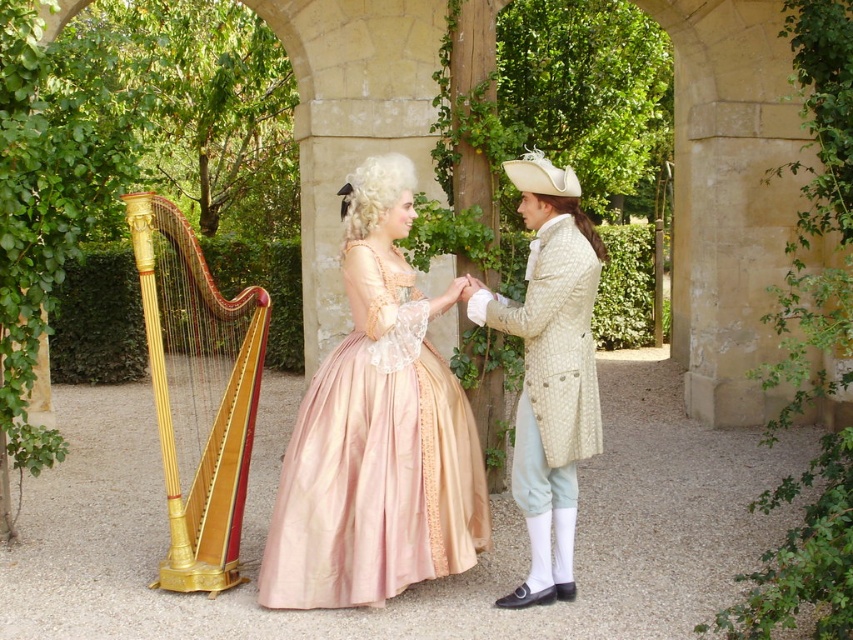
Looking at this image, you are standing at the entrance of the courtyard and want to locate the pink satin dress at center. Based on the coordinates provided, in which direction should you walk to reach it?

The pink satin dress at center is located at coordinates point (376, 458), so you should walk towards the center of the courtyard to reach it.

You are standing in the garden scene and want to place a small flower pot between the two points labeled as point (187,330) and point (502,326). Which point should the flower pot be closer to in order to be placed closer to the camera?

The flower pot should be closer to point (187,330) because it is further to the camera than point (502,326).

You are an artist sketching the scene and want to capture the positions of the two central figures accurately. Which clothing item is positioned lower in the image, the pink satin dress at center or the light beige textured coat at center?

The pink satin dress at center is located below the light beige textured coat at center, so it is positioned lower in the image.